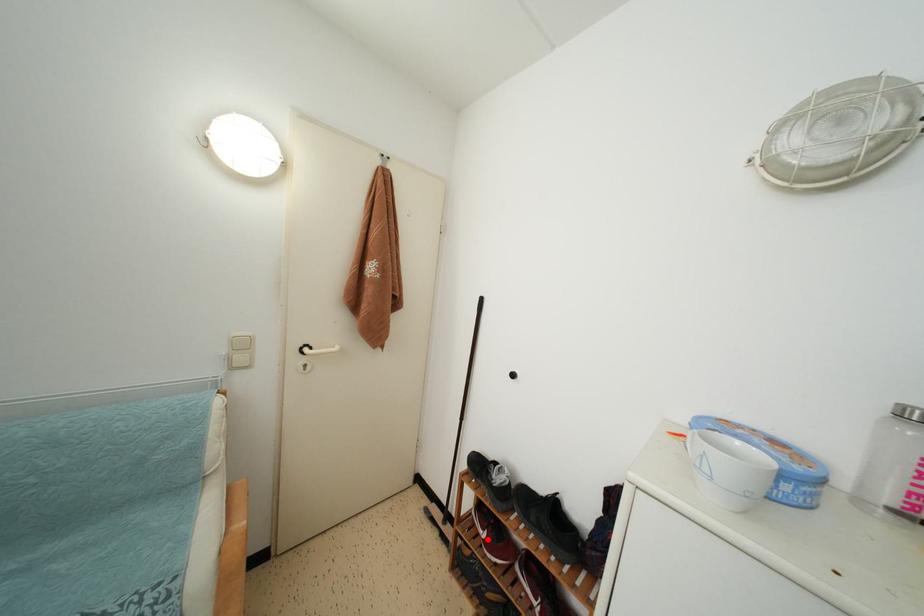
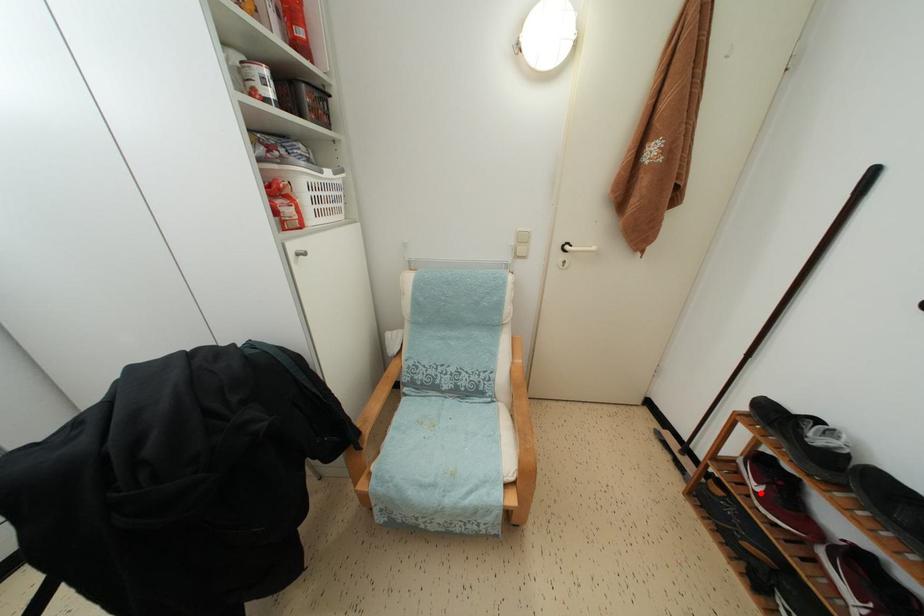
I am providing you with two images of the same scene from different viewpoints. A red point is marked on the first image and another point is marked on the second image. Is the marked point in image1 the same physical position as the marked point in image2?

Yes